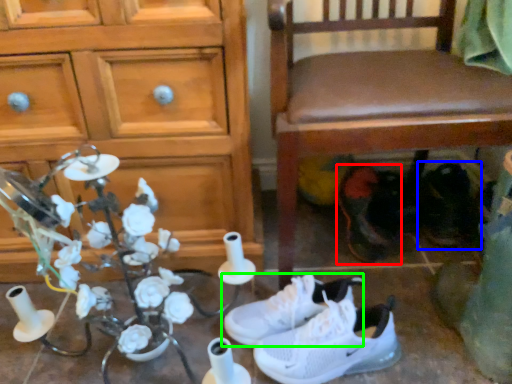
Question: Which object is the farthest from footwear (highlighted by a red box)? Choose among these: footwear (highlighted by a blue box) or footwear (highlighted by a green box).

Choices:
 (A) footwear
 (B) footwear

Answer: (B)